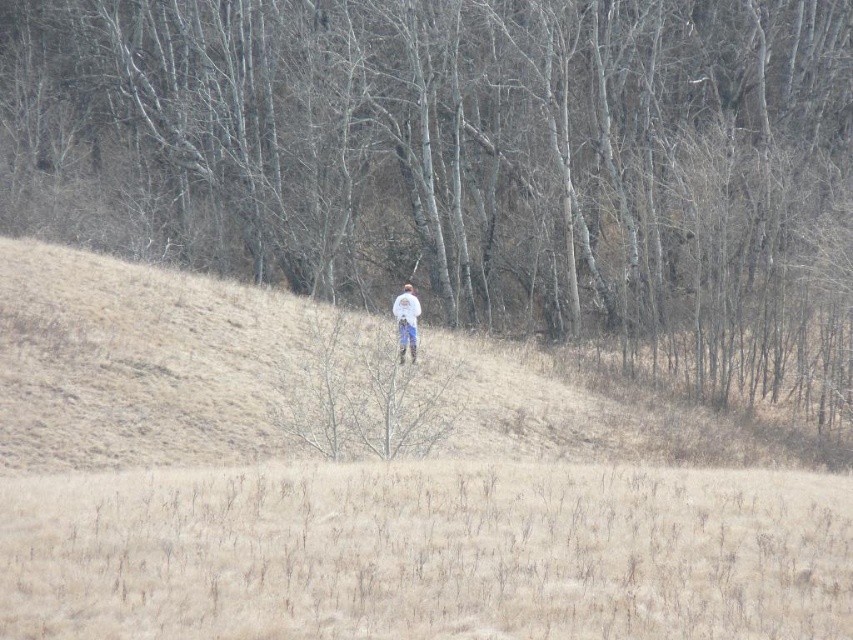
Who is more distant from viewer, (277, 102) or (434, 540)?

Positioned behind is point (277, 102).

Consider the image. Between brown bark tree at center and dry grass at center, which one has less height?

dry grass at center

This screenshot has width=853, height=640. I want to click on brown bark tree at center, so click(x=480, y=160).

Where is `brown bark tree at center`? This screenshot has width=853, height=640. brown bark tree at center is located at coordinates (480, 160).

Who is higher up, brown bark tree at center or white cotton shirt at center?

brown bark tree at center

Does point (366, 285) lie in front of point (416, 316)?

That is False.

Locate an element on the screen. The image size is (853, 640). brown bark tree at center is located at coordinates (480, 160).

Which of these two, dry grass at center or white cotton shirt at center, stands taller?

white cotton shirt at center is taller.

Who is shorter, dry grass at center or white cotton shirt at center?

With less height is dry grass at center.

Who is more distant from viewer, [134,532] or [410,330]?

The point [410,330] is behind.

Identify the location of dry grass at center. (427, 554).